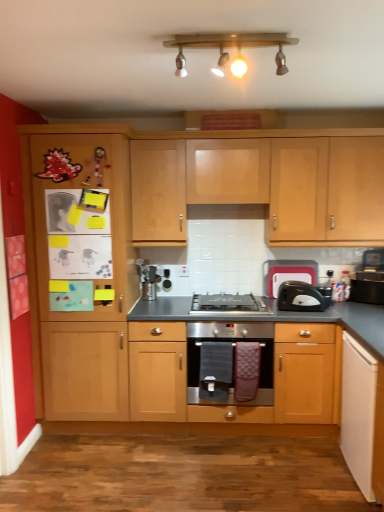
Find the location of `vacant space underneath black plastic toaster at right (from a real-world perspective)`. vacant space underneath black plastic toaster at right (from a real-world perspective) is located at coordinates (314, 309).